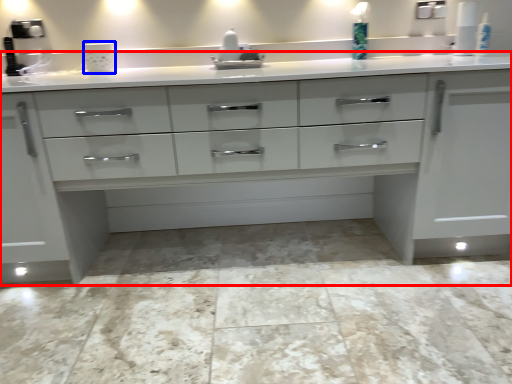
Question: Which object is further to the camera taking this photo, chest of drawers (highlighted by a red box) or appliance (highlighted by a blue box)?

Choices:
 (A) chest of drawers
 (B) appliance

Answer: (B)